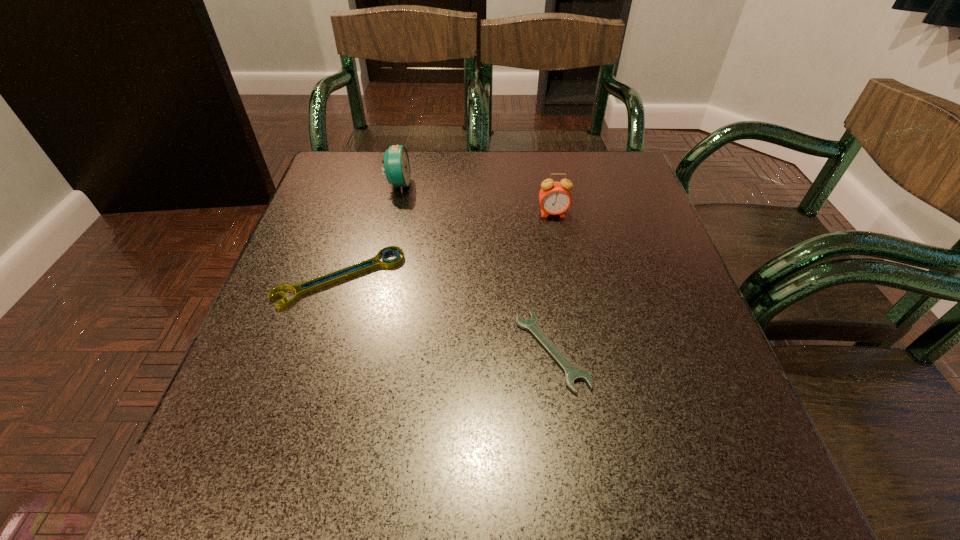
In order to click on the left alarm clock in this screenshot , I will do `click(396, 161)`.

The image size is (960, 540). Identify the location of the farther alarm clock. (396, 161).

Image resolution: width=960 pixels, height=540 pixels. I want to click on the second farthest object, so click(x=555, y=198).

I want to click on the nearer alarm clock, so click(x=555, y=198).

Where is `the farther wrench`? the farther wrench is located at coordinates (342, 274).

Where is `the left wrench`? The width and height of the screenshot is (960, 540). the left wrench is located at coordinates (342, 274).

Image resolution: width=960 pixels, height=540 pixels. In order to click on the right wrench in this screenshot , I will do `click(572, 374)`.

You are a GUI agent. You are given a task and a screenshot of the screen. Output one action in this format:
    pyautogui.click(x=<x>, y=<y>)
    Task: Click on the nearest object
    Image resolution: width=960 pixels, height=540 pixels.
    Given the screenshot: What is the action you would take?
    pyautogui.click(x=572, y=374)

Where is `free region located on the front-facing side of the left alarm clock`? This screenshot has height=540, width=960. free region located on the front-facing side of the left alarm clock is located at coordinates (552, 185).

Find the location of a particular element. The image size is (960, 540). blank area located on the face of the right alarm clock is located at coordinates [559, 244].